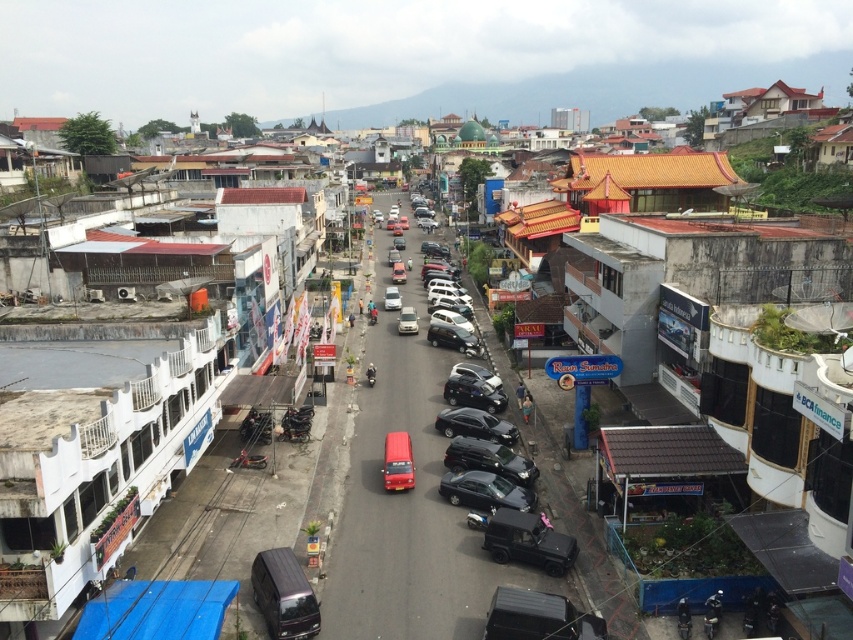
Question: Can you confirm if matte black car at center is smaller than satin silver sedan at center?

Choices:
 (A) yes
 (B) no

Answer: (B)

Question: Does satin silver sedan at center appear on the right side of matte silver van at center?

Choices:
 (A) no
 (B) yes

Answer: (B)

Question: Is metallic black van at center below matte silver van at center?

Choices:
 (A) yes
 (B) no

Answer: (A)

Question: Which point is farther to the camera?

Choices:
 (A) (405, 333)
 (B) (397, 300)
 (C) (404, 278)
 (D) (310, 605)

Answer: (C)

Question: Estimate the real-world distances between objects in this image. Which object is closer to the matte silver van at center?

Choices:
 (A) matte white van at center
 (B) matte red bus at center

Answer: (A)

Question: Estimate the real-world distances between objects in this image. Which object is closer to the matte black car at center?

Choices:
 (A) matte silver van at center
 (B) metallic black van at center
 (C) matte red bus at center

Answer: (B)